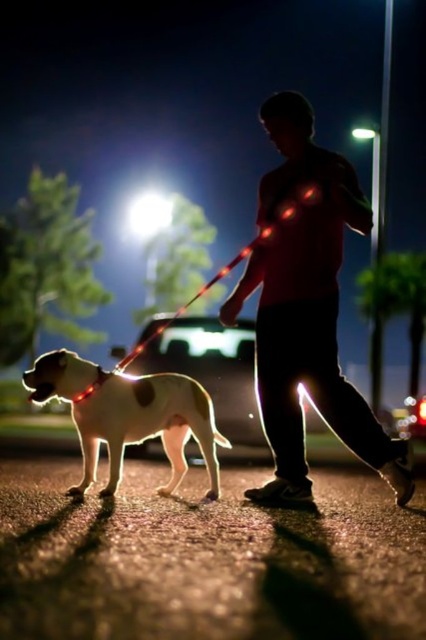
You are a security guard monitoring a nighttime scene. You notice a person wearing a black matte shirt at center and a shiny white dog at center. Based on the lighting, which object is closer to the light source?

The black matte shirt at center is located above the shiny white dog at center, so it is closer to the light source in the background.

You are a photographer trying to capture the scene. The camera can only focus on objects with a width of at least 1 meter. Given that the black matte shirt at center is narrower than the shiny white dog at center, which object should you focus on to ensure it meets the focus requirement?

The shiny white dog at center has a greater width than the black matte shirt at center, so focusing on the shiny white dog at center would be more likely to meet the camera focus requirement of at least 1 meter width.